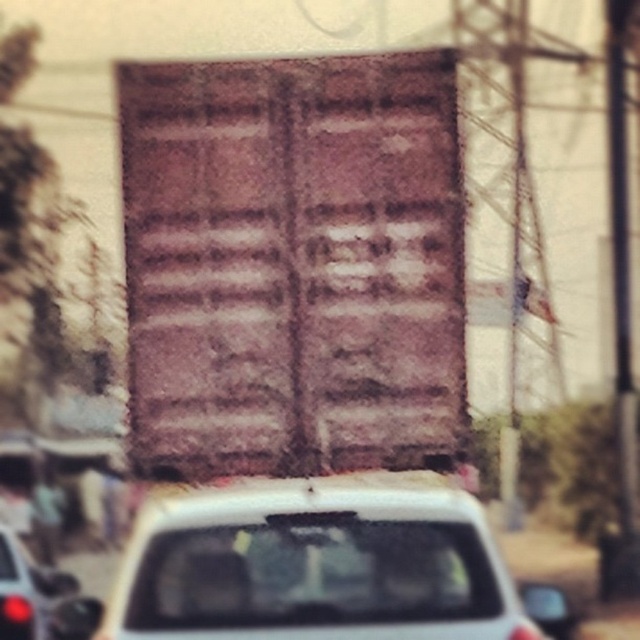
Is white matte car at center above metallic silver car at lower left?

Indeed, white matte car at center is positioned over metallic silver car at lower left.

Can you confirm if white matte car at center is taller than metallic silver car at lower left?

Yes.

This screenshot has width=640, height=640. I want to click on white matte car at center, so click(x=321, y=564).